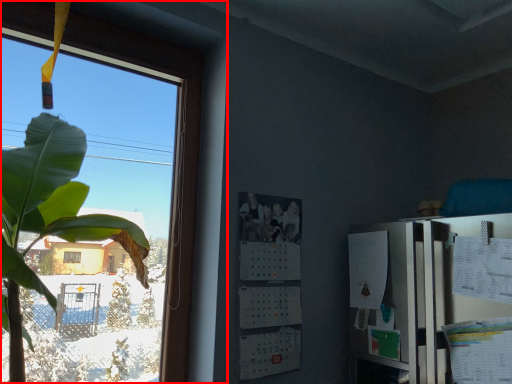
Question: From the image, what is the correct spatial relationship of window (annotated by the red box) in relation to bulletin board?

Choices:
 (A) left
 (B) right

Answer: (A)